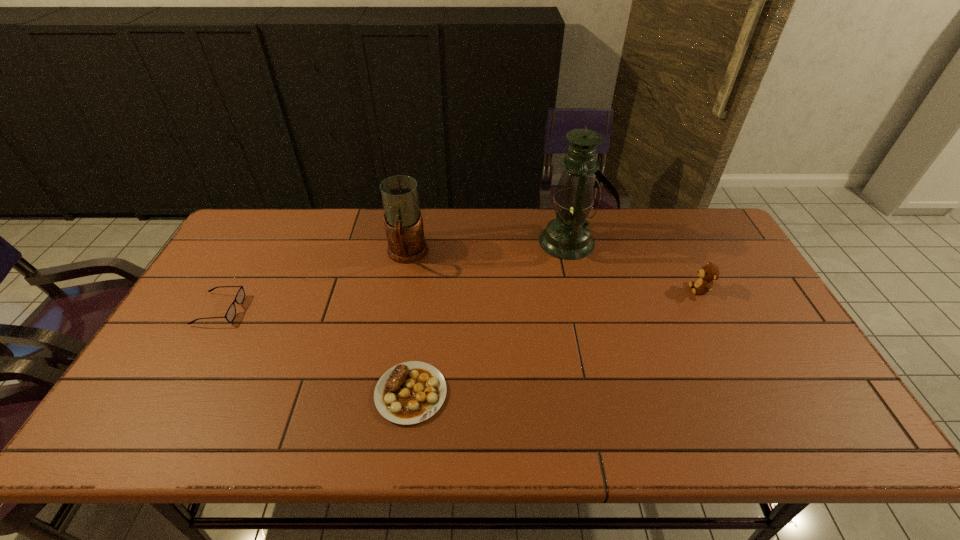
Where is `the second object from right to left`? the second object from right to left is located at coordinates (567, 236).

This screenshot has width=960, height=540. In order to click on the tallest object in this screenshot , I will do `click(567, 236)`.

Locate an element on the screen. The width and height of the screenshot is (960, 540). pitcher is located at coordinates (403, 220).

Locate an element on the screen. The image size is (960, 540). the rightmost object is located at coordinates (708, 273).

What are the coordinates of `the third tallest object` in the screenshot? It's located at (708, 273).

Locate an element on the screen. the leftmost object is located at coordinates (240, 296).

Identify the location of the shortest object. coord(411,392).

Locate an element on the screen. The image size is (960, 540). steak is located at coordinates [411, 392].

What are the coordinates of `vacant region located 0.180m on the left of the fourth object from left to right` in the screenshot? It's located at (485, 241).

Where is `free space located with the handle on the side of the fourth shortest object`? The height and width of the screenshot is (540, 960). free space located with the handle on the side of the fourth shortest object is located at coordinates point(385,375).